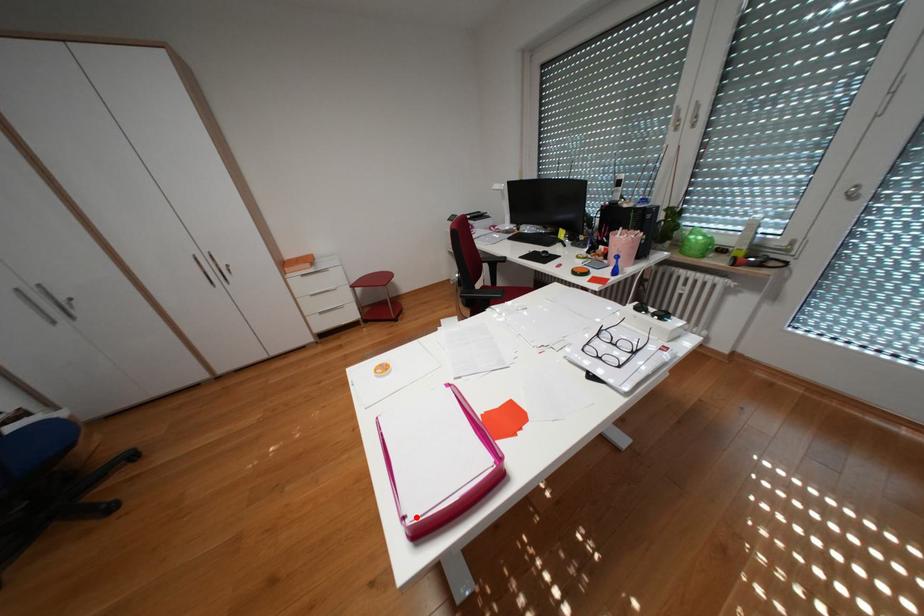
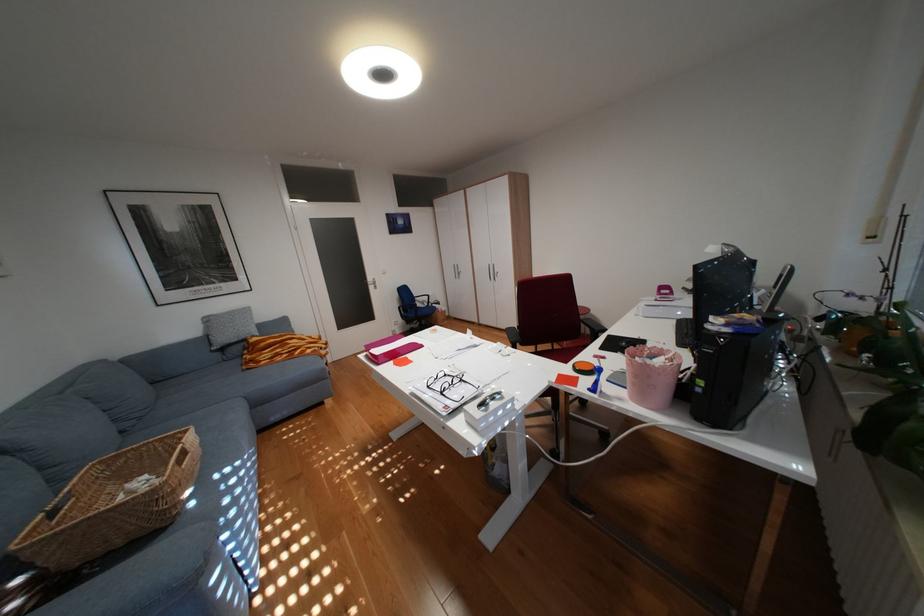
Question: I am providing you with two images of the same scene from different viewpoints. Image1 has a red point marked. In image2, the corresponding 3D location appears at what relative position? Reply with the corresponding letter.

Choices:
 (A) Closer
 (B) Farther

Answer: (A)